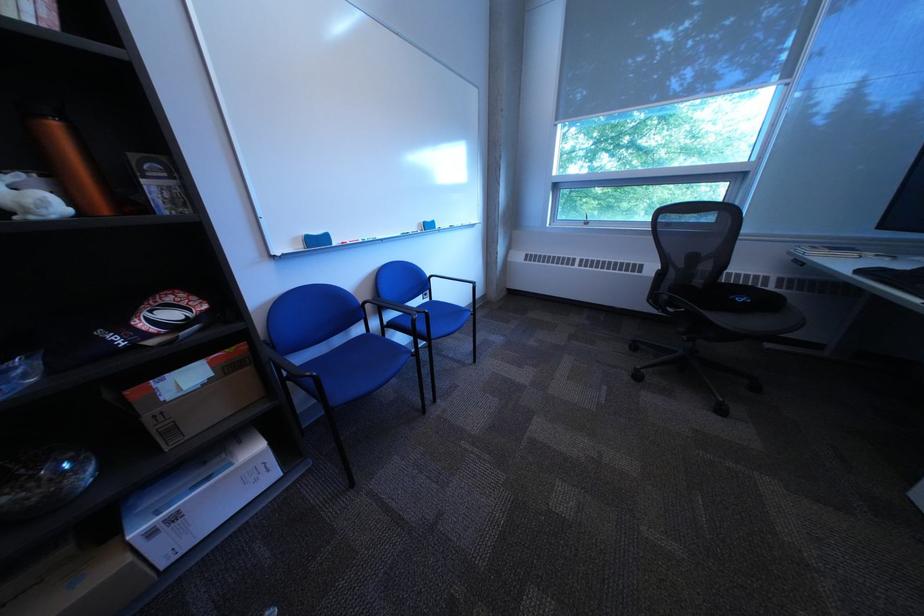
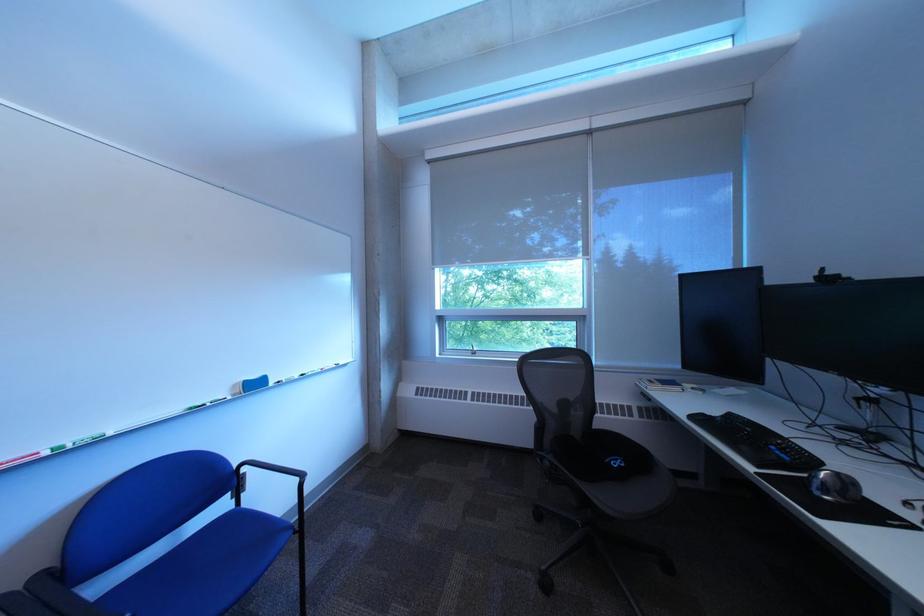
What movement of the cameraman would produce the second image?

The movement direction of the cameraman is right, forward.